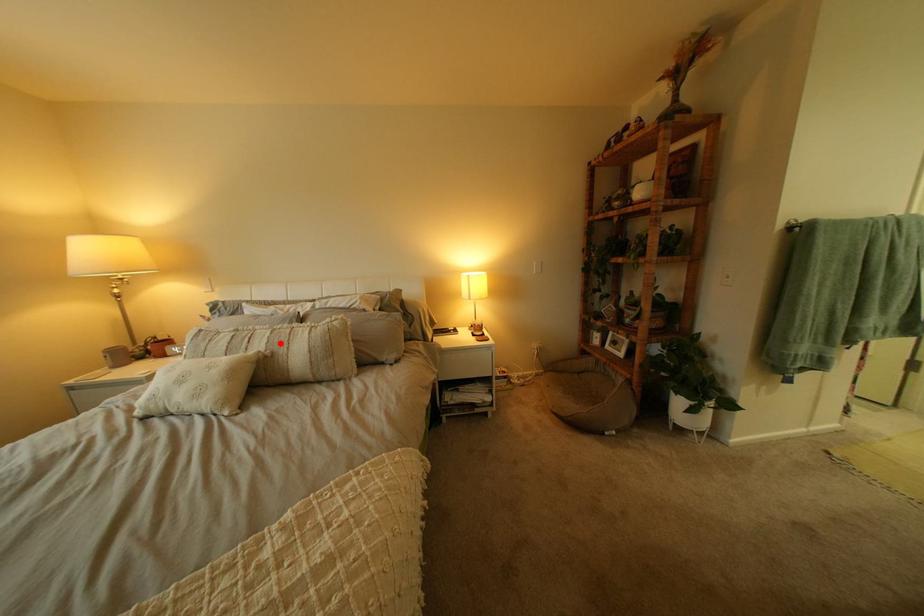
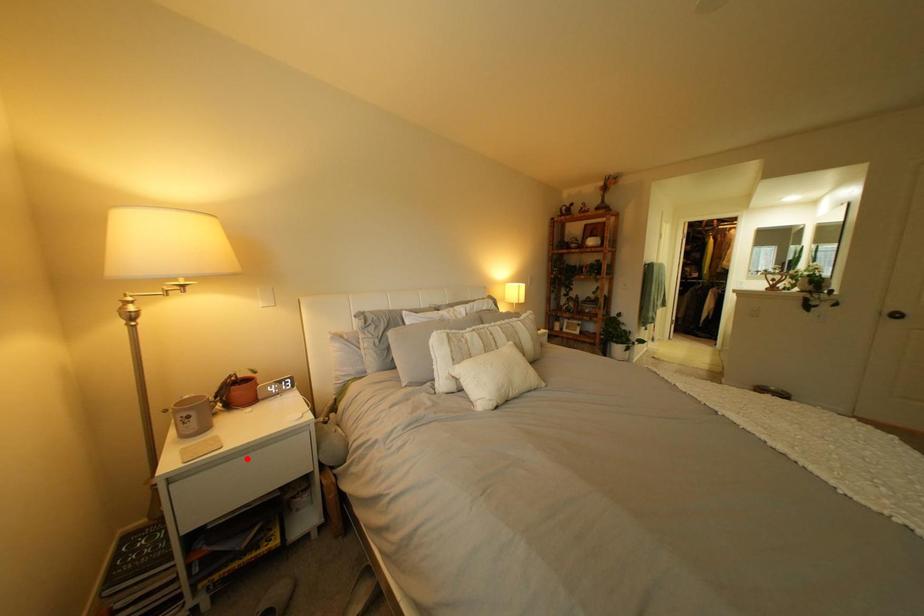
I am providing you with two images of the same scene from different viewpoints. A red point is marked on the first image and another point is marked on the second image. Does the point marked in image1 correspond to the same location as the one in image2?

No